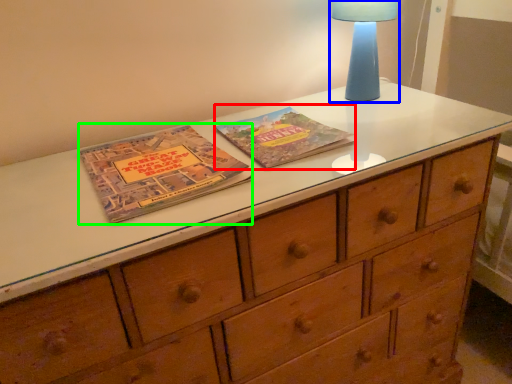
Question: Considering the real-world distances, which object is closest to paperback book (highlighted by a red box)? bedside lamp (highlighted by a blue box) or paperback book (highlighted by a green box).

Choices:
 (A) bedside lamp
 (B) paperback book

Answer: (B)